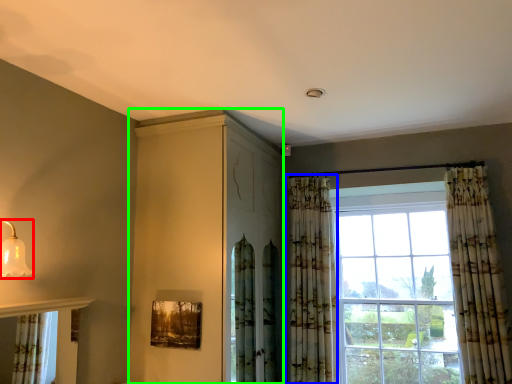
Question: Which object is the farthest from light fixture (highlighted by a red box)? Choose among these: curtain (highlighted by a blue box) or dresser (highlighted by a green box).

Choices:
 (A) curtain
 (B) dresser

Answer: (A)